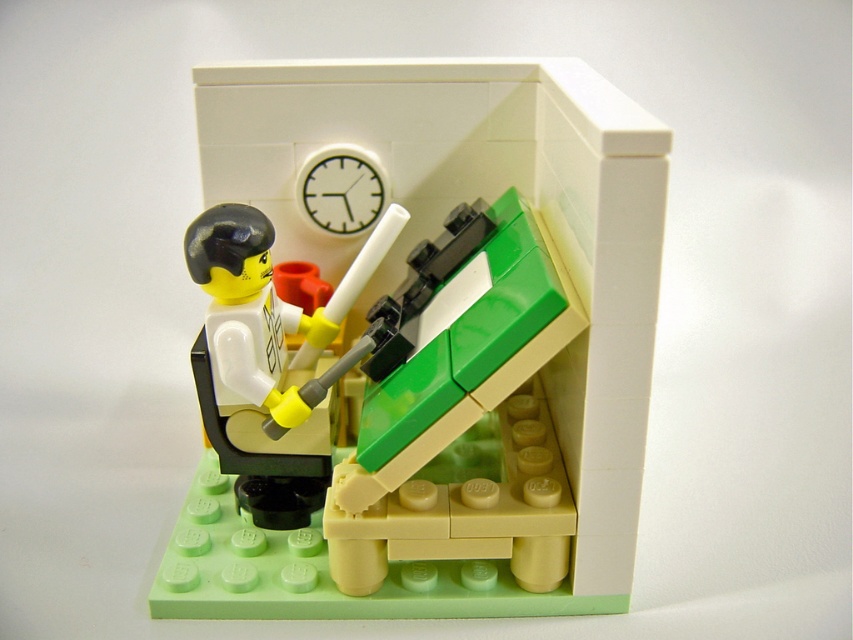
Question: Which of the following is the closest to the observer?

Choices:
 (A) pyautogui.click(x=335, y=227)
 (B) pyautogui.click(x=282, y=332)
 (C) pyautogui.click(x=631, y=369)

Answer: (C)

Question: Which object appears closest to the camera in this image?

Choices:
 (A) yellow matte figure at center-left
 (B) white plastic clock at upper center
 (C) matte green plastic desk at center

Answer: (C)

Question: Is matte green plastic desk at center wider than yellow matte figure at center-left?

Choices:
 (A) yes
 (B) no

Answer: (A)

Question: Is matte green plastic desk at center thinner than yellow matte figure at center-left?

Choices:
 (A) yes
 (B) no

Answer: (B)

Question: Which of these objects is positioned closest to the yellow matte figure at center-left?

Choices:
 (A) white plastic clock at upper center
 (B) matte green plastic desk at center

Answer: (B)

Question: Is yellow matte figure at center-left thinner than white plastic clock at upper center?

Choices:
 (A) no
 (B) yes

Answer: (A)